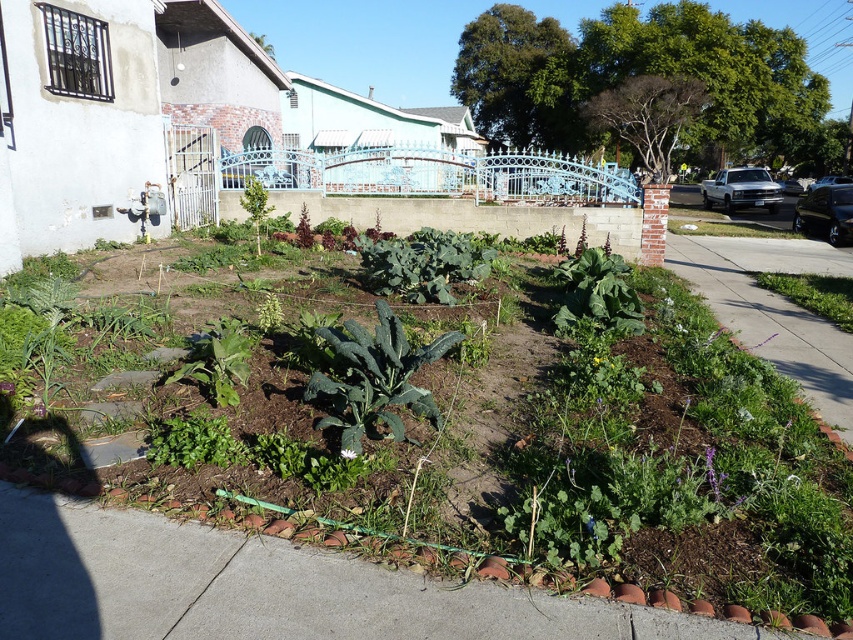
Can you confirm if green leafy vegetables at center is positioned below green grass at lower right?

Indeed, green leafy vegetables at center is positioned under green grass at lower right.

Who is positioned more to the left, green leafy vegetables at center or green grass at lower right?

Positioned to the left is green leafy vegetables at center.

Where is `green leafy vegetables at center`? The image size is (853, 640). green leafy vegetables at center is located at coordinates (518, 468).